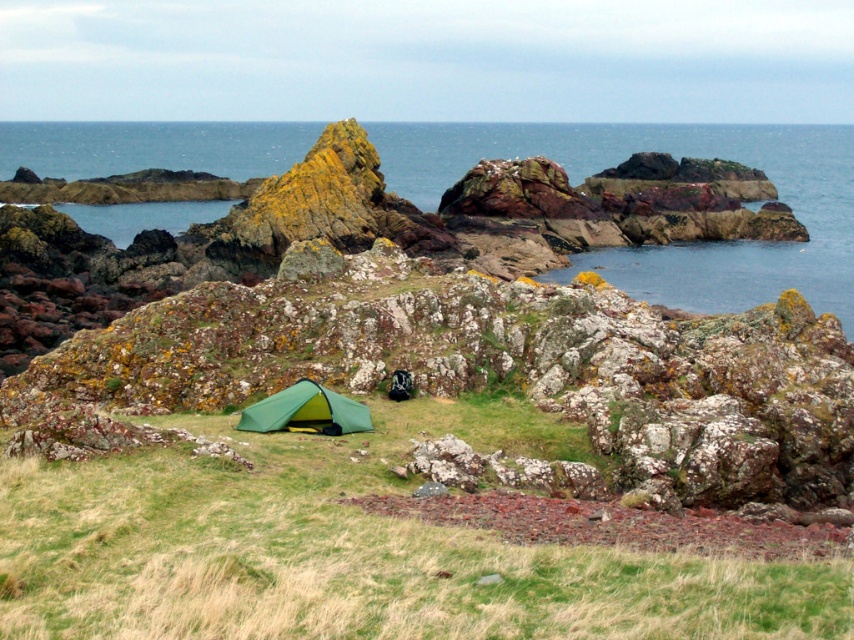
Question: Can you confirm if green grassy at center is bigger than green fabric tent at center?

Choices:
 (A) yes
 (B) no

Answer: (A)

Question: Which point appears closest to the camera in this image?

Choices:
 (A) (322, 394)
 (B) (302, 573)

Answer: (B)

Question: Where is green grassy at center located in relation to green fabric tent at center in the image?

Choices:
 (A) below
 (B) above

Answer: (A)

Question: Which point appears closest to the camera in this image?

Choices:
 (A) (313, 392)
 (B) (468, 536)

Answer: (B)

Question: Does green grassy at center have a greater width compared to green fabric tent at center?

Choices:
 (A) no
 (B) yes

Answer: (B)

Question: Which object appears closest to the camera in this image?

Choices:
 (A) green grassy at center
 (B) green fabric tent at center

Answer: (A)